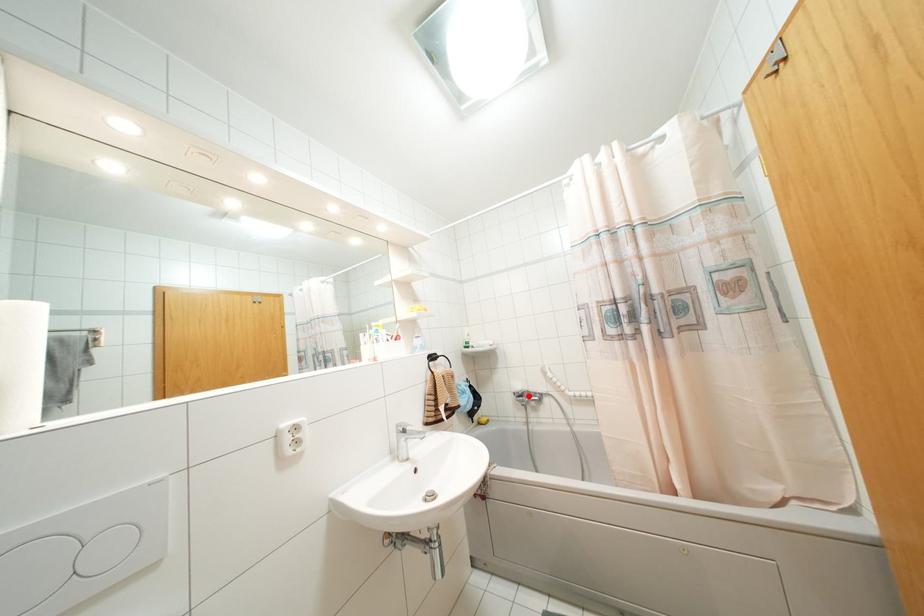
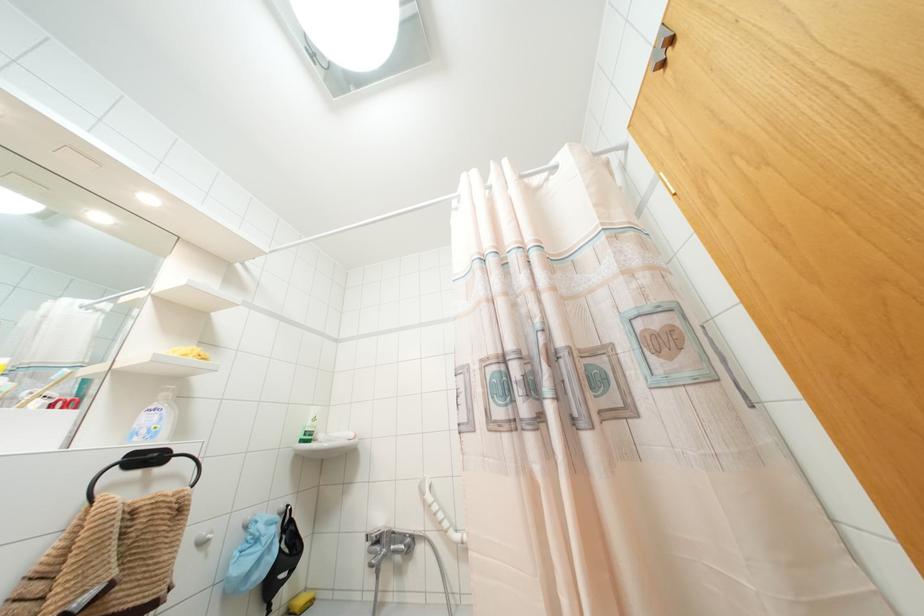
Locate, in the second image, the point that corresponds to the highlighted location in the first image.

(390, 541)